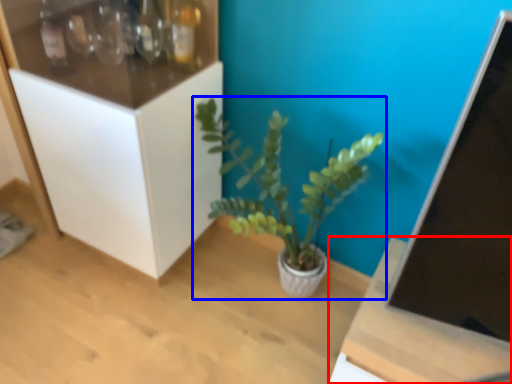
Question: Which object appears closest to the camera in this image, table (highlighted by a red box) or houseplant (highlighted by a blue box)?

Choices:
 (A) table
 (B) houseplant

Answer: (A)